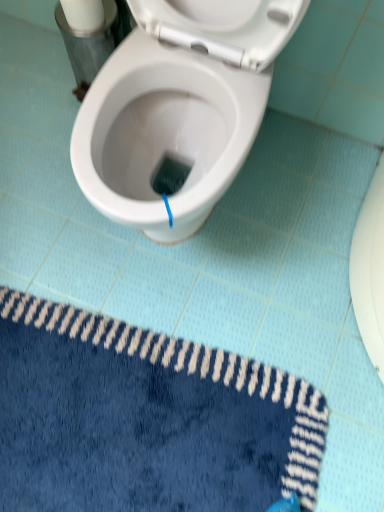
Question: From the image's perspective, is blue plush bath mat at lower left on top of white matte toilet paper at upper left?

Choices:
 (A) yes
 (B) no

Answer: (B)

Question: From a real-world perspective, is blue plush bath mat at lower left located beneath white matte toilet paper at upper left?

Choices:
 (A) yes
 (B) no

Answer: (A)

Question: Is blue plush bath mat at lower left thinner than white matte toilet paper at upper left?

Choices:
 (A) yes
 (B) no

Answer: (B)

Question: Are blue plush bath mat at lower left and white matte toilet paper at upper left making contact?

Choices:
 (A) no
 (B) yes

Answer: (A)

Question: Does blue plush bath mat at lower left come behind white matte toilet paper at upper left?

Choices:
 (A) no
 (B) yes

Answer: (A)

Question: Is white matte toilet paper at upper left inside blue plush bath mat at lower left?

Choices:
 (A) no
 (B) yes

Answer: (A)

Question: Would you say white matte toilet paper at upper left is outside blue plush bath mat at lower left?

Choices:
 (A) no
 (B) yes

Answer: (B)

Question: Does white matte toilet paper at upper left have a smaller size compared to blue plush bath mat at lower left?

Choices:
 (A) yes
 (B) no

Answer: (A)

Question: Does white matte toilet paper at upper left have a greater height compared to blue plush bath mat at lower left?

Choices:
 (A) yes
 (B) no

Answer: (A)

Question: From a real-world perspective, is white matte toilet paper at upper left physically below blue plush bath mat at lower left?

Choices:
 (A) yes
 (B) no

Answer: (B)

Question: Does white matte toilet paper at upper left have a lesser height compared to blue plush bath mat at lower left?

Choices:
 (A) yes
 (B) no

Answer: (B)

Question: Is white matte toilet paper at upper left further to the viewer compared to blue plush bath mat at lower left?

Choices:
 (A) no
 (B) yes

Answer: (B)

Question: In the image, is white matte toilet paper at upper left positioned in front of or behind blue plush bath mat at lower left?

Choices:
 (A) front
 (B) behind

Answer: (B)